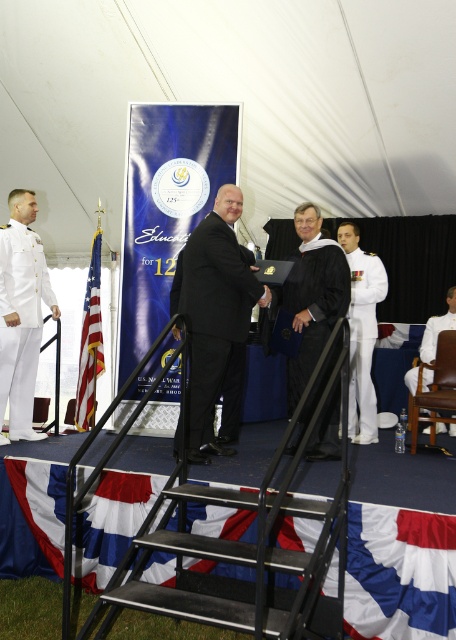
In the scene shown: You are attending a graduation ceremony and notice the red fabric flag at center and the black matte suit at center. From your perspective, which object is positioned to the left?

The red fabric flag at center is to the left of the black matte suit at center.

What is the color of the pants located at the point with coordinates (20,321)?

The pants at point (20,321) are white cotton pants.

You are attending a graduation ceremony and notice two individuals on the stage. One is wearing white cotton pants at left and the other is wearing a white cotton uniform at right. Based on their clothing sizes, which individual do you think might be the graduate?

The white cotton pants at left has a smaller size compared to the white cotton uniform at right, so the graduate is likely the one wearing the white cotton pants at left since graduates often wear smaller attire during ceremonies.